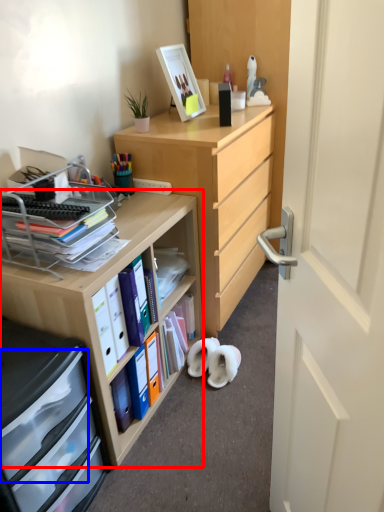
Question: Which point is closer to the camera, desk (highlighted by a red box) or drawer (highlighted by a blue box)?

Choices:
 (A) desk
 (B) drawer

Answer: (B)